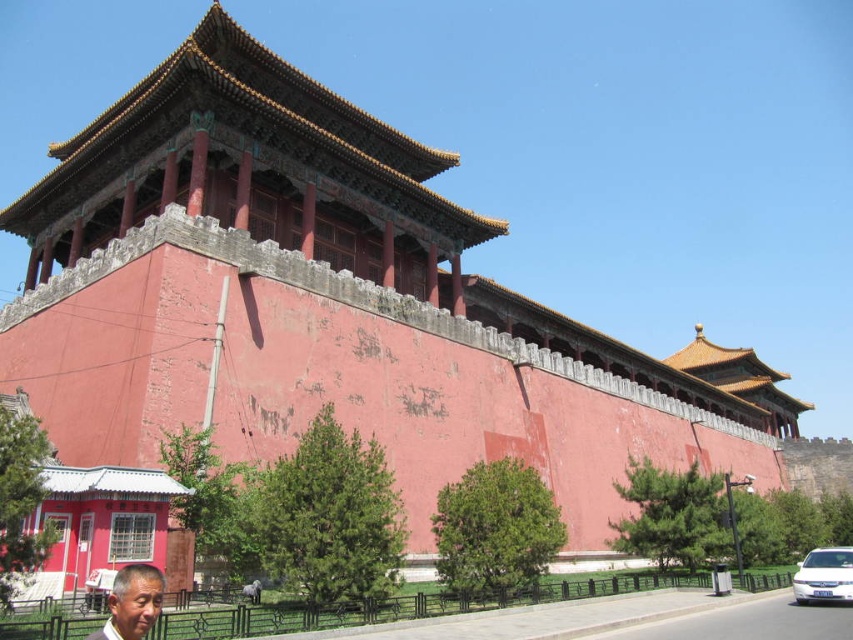
In the scene shown: You are standing in front of the Forbidden City wall and notice a matte gray face at lower left and a white glossy minivan at lower right. Which object is shorter in height?

The matte gray face at lower left has a lesser height compared to the white glossy minivan at lower right, so the matte gray face at lower left is shorter in height.

You are standing in front of the Forbidden City wall and see a point marked at coordinates (132, 602). Based on the description, what object is located at this point?

The point at coordinates (132, 602) corresponds to a matte gray face at lower left.